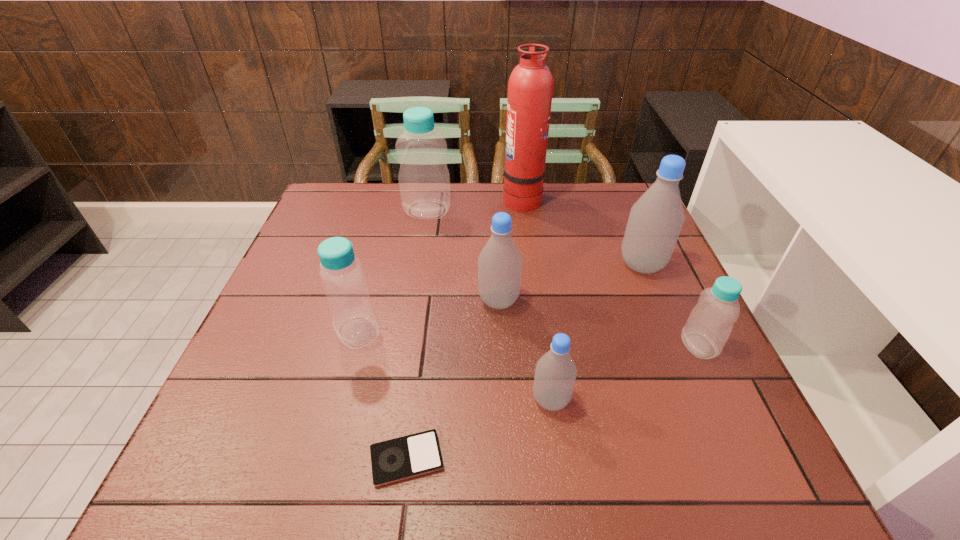
At what (x,y) coordinates should I click in order to perform the action: click on vacant space situated 0.160m on the front of the smallest blue bottle. Please return your answer as a coordinate pair (x, y). This screenshot has width=960, height=540. Looking at the image, I should click on (741, 435).

Locate an element on the screen. vacant region located on the left of the third bottle from right to left is located at coordinates (500, 400).

I want to click on vacant space situated 0.210m on the left of the shortest object, so click(247, 459).

Where is `fire extinguisher located in the far edge section of the desktop`? The image size is (960, 540). fire extinguisher located in the far edge section of the desktop is located at coordinates (530, 88).

Locate an element on the screen. The width and height of the screenshot is (960, 540). bottle situated at the far edge is located at coordinates (424, 181).

Find the location of a particular element. This screenshot has width=960, height=540. object positioned at the near edge is located at coordinates pyautogui.click(x=410, y=456).

At what (x,y) coordinates should I click in order to perform the action: click on vacant space at the far edge. Please return your answer as a coordinate pair (x, y). Image resolution: width=960 pixels, height=540 pixels. Looking at the image, I should click on (488, 182).

Identify the location of free location at the near edge of the desktop. (506, 461).

I want to click on vacant point at the right edge, so click(x=702, y=423).

Where is `free location at the far left corner`? The width and height of the screenshot is (960, 540). free location at the far left corner is located at coordinates (324, 198).